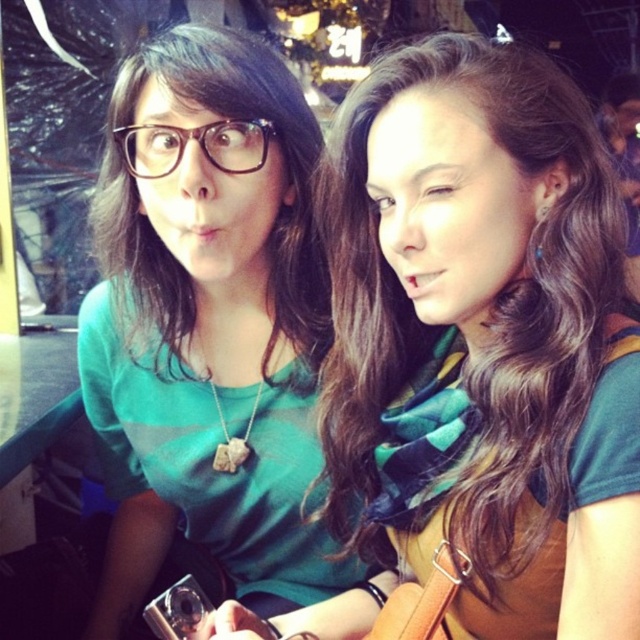
Can you confirm if green matte shirt at left is wider than black plastic glasses at upper left?

Indeed, green matte shirt at left has a greater width compared to black plastic glasses at upper left.

Is green matte shirt at left behind black plastic glasses at upper left?

That is False.

This screenshot has height=640, width=640. Describe the element at coordinates (212, 333) in the screenshot. I see `green matte shirt at left` at that location.

Where is `green matte shirt at left`? green matte shirt at left is located at coordinates (212, 333).

How far apart are green matte shirt at upper left and black plastic glasses at upper left?

green matte shirt at upper left is 30.46 centimeters away from black plastic glasses at upper left.

This screenshot has height=640, width=640. Describe the element at coordinates (483, 342) in the screenshot. I see `green matte shirt at upper left` at that location.

Locate an element on the screen. green matte shirt at upper left is located at coordinates (483, 342).

Between green matte shirt at upper left and green matte shirt at left, which one appears on the left side from the viewer's perspective?

green matte shirt at left

Does green matte shirt at upper left lie in front of green matte shirt at left?

Yes, it is.

Is point (449, 403) more distant than point (292, 141)?

That is False.

At what (x,y) coordinates should I click in order to perform the action: click on green matte shirt at upper left. Please return your answer as a coordinate pair (x, y). The image size is (640, 640). Looking at the image, I should click on (483, 342).